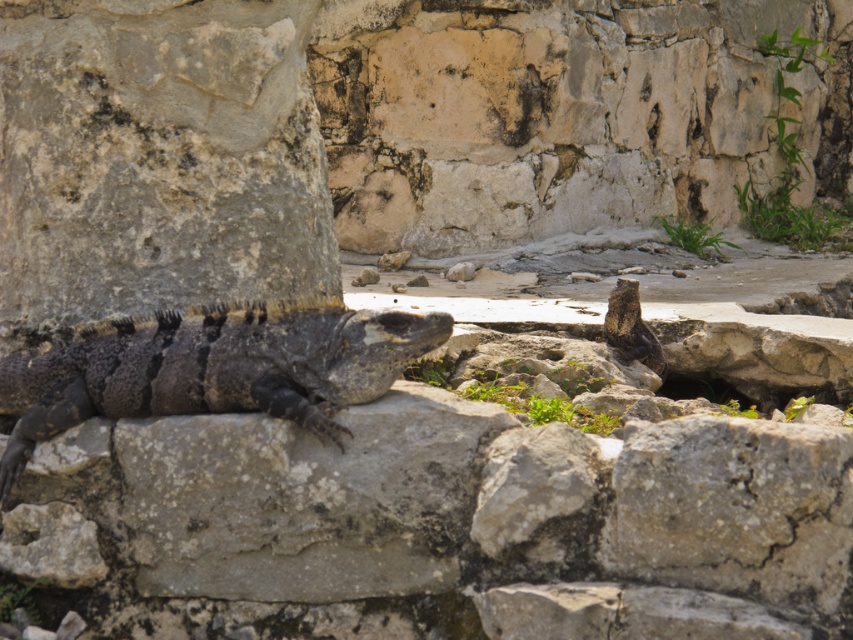
The height and width of the screenshot is (640, 853). Describe the element at coordinates (213, 368) in the screenshot. I see `dark gray scaly lizard at center` at that location.

Does point (321, 330) come behind point (625, 310)?

No, (321, 330) is in front of (625, 310).

You are a GUI agent. You are given a task and a screenshot of the screen. Output one action in this format:
    pyautogui.click(x=<x>, y=<y>)
    Task: Click on the dark gray scaly lizard at center
    This screenshot has width=853, height=640.
    Given the screenshot: What is the action you would take?
    pyautogui.click(x=213, y=368)